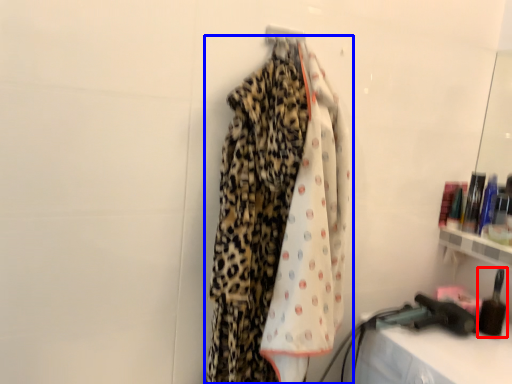
Question: Which of the following is the farthest to the observer, toiletry (highlighted by a red box) or curtain (highlighted by a blue box)?

Choices:
 (A) toiletry
 (B) curtain

Answer: (A)